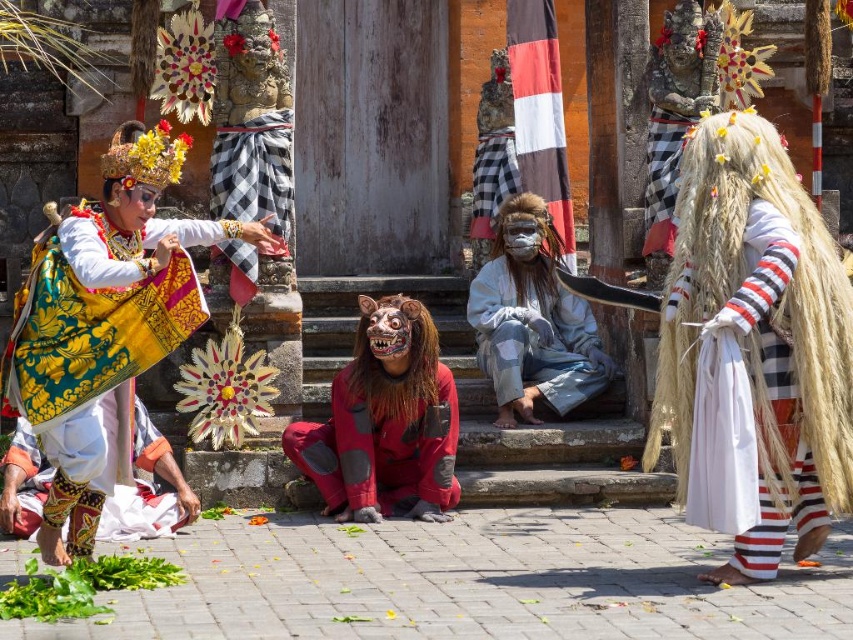
Question: Which point appears closest to the camera in this image?

Choices:
 (A) (154, 428)
 (B) (370, 484)

Answer: (B)

Question: Based on their relative distances, which object is nearer to the white woven fabric at right?

Choices:
 (A) red matte mask at center
 (B) textured batik skirt at lower left

Answer: (A)

Question: Among these objects, which one is nearest to the camera?

Choices:
 (A) vibrant silk dress at left
 (B) red matte mask at center
 (C) white woven fabric at right

Answer: (C)

Question: Does vibrant silk dress at left appear on the right side of textured batik skirt at lower left?

Choices:
 (A) no
 (B) yes

Answer: (A)

Question: Can you confirm if red matte mask at center is positioned to the right of textured batik skirt at lower left?

Choices:
 (A) yes
 (B) no

Answer: (A)

Question: Can you confirm if red matte mask at center is positioned to the left of vibrant silk dress at left?

Choices:
 (A) yes
 (B) no

Answer: (B)